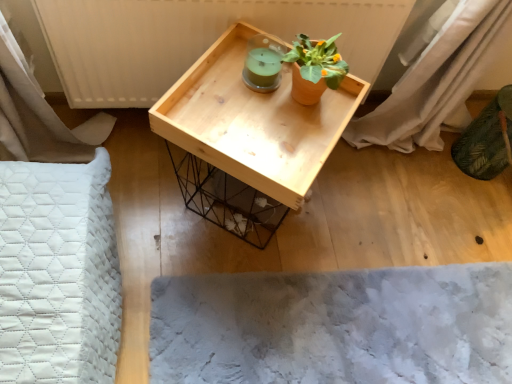
This screenshot has width=512, height=384. Find the location of `terracotta clay pot at upper center`. terracotta clay pot at upper center is located at coordinates (314, 68).

Locate an element on the screen. natural wood tray at center is located at coordinates (247, 138).

Locate an element on the screen. Image resolution: width=512 pixels, height=384 pixels. matte white radiator at upper center is located at coordinates (194, 39).

Is point (314, 75) less distant than point (220, 167)?

No, it is not.

Is terracotta clay pot at upper center not inside natural wood tray at center?

Actually, terracotta clay pot at upper center is at least partially inside natural wood tray at center.

Looking at this image, are terracotta clay pot at upper center and natural wood tray at center far apart?

No, terracotta clay pot at upper center is not far from natural wood tray at center.

Is terracotta clay pot at upper center oriented towards natural wood tray at center?

No, terracotta clay pot at upper center is not turned towards natural wood tray at center.

Where is `radiator in front of the fuzzy gray mat at lower center`? The height and width of the screenshot is (384, 512). radiator in front of the fuzzy gray mat at lower center is located at coordinates (194, 39).

Is fuzzy gray mat at lower center facing away from matte white radiator at upper center?

That's not correct — fuzzy gray mat at lower center is not looking away from matte white radiator at upper center.

Is fuzzy gray mat at lower center outside of matte white radiator at upper center?

fuzzy gray mat at lower center lies outside matte white radiator at upper center's area.

How many degrees apart are the facing directions of natural wood tray at center and matte white radiator at upper center?

They differ by 54.1 degrees in their facing directions.

Is natural wood tray at center placed right next to matte white radiator at upper center?

natural wood tray at center and matte white radiator at upper center are clearly separated.

Considering the positions of objects natural wood tray at center and matte white radiator at upper center in the image provided, who is in front, natural wood tray at center or matte white radiator at upper center?

natural wood tray at center is closer to the camera.

Considering the sizes of objects natural wood tray at center and matte white radiator at upper center in the image provided, who is bigger, natural wood tray at center or matte white radiator at upper center?

natural wood tray at center is bigger.

Measure the distance between matte white radiator at upper center and fuzzy gray mat at lower center.

matte white radiator at upper center and fuzzy gray mat at lower center are 74.42 centimeters apart.

Is matte white radiator at upper center facing towards fuzzy gray mat at lower center?

Yes, matte white radiator at upper center is aimed at fuzzy gray mat at lower center.

Which is behind, matte white radiator at upper center or fuzzy gray mat at lower center?

fuzzy gray mat at lower center is further from the camera.

From the image's perspective, between matte white radiator at upper center and fuzzy gray mat at lower center, which one is located above?

matte white radiator at upper center.

Considering the positions of points (170, 83) and (262, 144), is point (170, 83) closer to camera compared to point (262, 144)?

No, (170, 83) is further to viewer.

Can you confirm if matte white radiator at upper center is thinner than natural wood tray at center?

Correct, the width of matte white radiator at upper center is less than that of natural wood tray at center.

Where is `table that appears on the right of matte white radiator at upper center`? The width and height of the screenshot is (512, 384). table that appears on the right of matte white radiator at upper center is located at coordinates (247, 138).

Based on the photo, considering the sizes of objects matte white radiator at upper center and natural wood tray at center in the image provided, who is shorter, matte white radiator at upper center or natural wood tray at center?

matte white radiator at upper center is shorter.

Is fuzzy gray mat at lower center bigger or smaller than terracotta clay pot at upper center?

fuzzy gray mat at lower center is bigger than terracotta clay pot at upper center.

Where is `houseplant in front of the fuzzy gray mat at lower center`? The width and height of the screenshot is (512, 384). houseplant in front of the fuzzy gray mat at lower center is located at coordinates (314, 68).

How distant is fuzzy gray mat at lower center from terracotta clay pot at upper center?

fuzzy gray mat at lower center and terracotta clay pot at upper center are 26.64 inches apart.

Is fuzzy gray mat at lower center shorter than terracotta clay pot at upper center?

Correct, fuzzy gray mat at lower center is not as tall as terracotta clay pot at upper center.

From a real-world perspective, who is located lower, natural wood tray at center or terracotta clay pot at upper center?

natural wood tray at center is physically lower.

Does natural wood tray at center have a greater height compared to terracotta clay pot at upper center?

Indeed, natural wood tray at center has a greater height compared to terracotta clay pot at upper center.

Is point (240, 32) farther from camera compared to point (331, 45)?

Yes, it is.

From the image's perspective, is natural wood tray at center located above or below terracotta clay pot at upper center?

From the image's perspective, natural wood tray at center appears below terracotta clay pot at upper center.

Find the location of a particular element. This screenshot has width=512, height=384. houseplant behind the natural wood tray at center is located at coordinates (314, 68).

Identify the location of radiator located in front of the fuzzy gray mat at lower center. The height and width of the screenshot is (384, 512). (194, 39).

Based on their spatial positions, is natural wood tray at center or matte white radiator at upper center further from fuzzy gray mat at lower center?

matte white radiator at upper center is further to fuzzy gray mat at lower center.

Estimate the real-world distances between objects in this image. Which object is further from matte white radiator at upper center, fuzzy gray mat at lower center or terracotta clay pot at upper center?

fuzzy gray mat at lower center lies further to matte white radiator at upper center than the other object.

Based on their spatial positions, is terracotta clay pot at upper center or fuzzy gray mat at lower center further from matte white radiator at upper center?

Among the two, fuzzy gray mat at lower center is located further to matte white radiator at upper center.

Considering their positions, is matte white radiator at upper center positioned further to natural wood tray at center than terracotta clay pot at upper center?

Based on the image, matte white radiator at upper center appears to be further to natural wood tray at center.

Based on their spatial positions, is natural wood tray at center or terracotta clay pot at upper center further from fuzzy gray mat at lower center?

Among the two, terracotta clay pot at upper center is located further to fuzzy gray mat at lower center.

Estimate the real-world distances between objects in this image. Which object is closer to terracotta clay pot at upper center, fuzzy gray mat at lower center or natural wood tray at center?

Based on the image, natural wood tray at center appears to be nearer to terracotta clay pot at upper center.

Looking at the image, which one is located closer to terracotta clay pot at upper center, natural wood tray at center or fuzzy gray mat at lower center?

natural wood tray at center.

Considering their positions, is matte white radiator at upper center positioned further to terracotta clay pot at upper center than natural wood tray at center?

Based on the image, matte white radiator at upper center appears to be further to terracotta clay pot at upper center.

This screenshot has height=384, width=512. I want to click on table between matte white radiator at upper center and fuzzy gray mat at lower center in the up-down direction, so click(x=247, y=138).

The image size is (512, 384). What are the coordinates of `houseplant between matte white radiator at upper center and fuzzy gray mat at lower center vertically` in the screenshot? It's located at (314, 68).

Find the location of a particular element. The height and width of the screenshot is (384, 512). houseplant between matte white radiator at upper center and natural wood tray at center vertically is located at coordinates (314, 68).

Where is `table that lies between terracotta clay pot at upper center and fuzzy gray mat at lower center from top to bottom`? table that lies between terracotta clay pot at upper center and fuzzy gray mat at lower center from top to bottom is located at coordinates (247, 138).